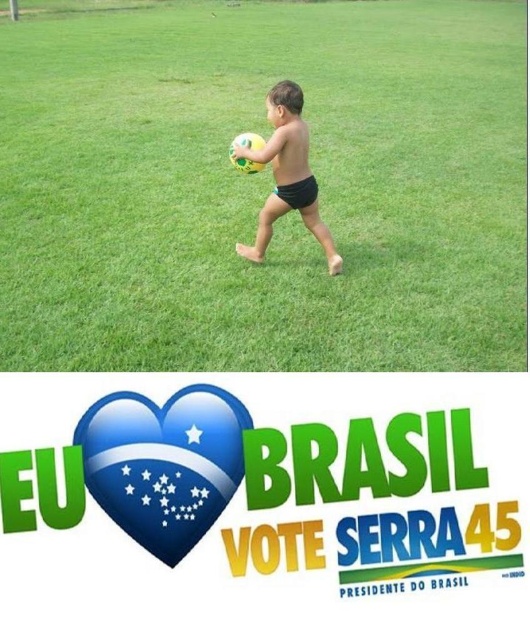
Looking at this image, you are a photographer who wants to capture the matte yellow ball at center and the green grass at center in the same frame. Based on their positions, which object should you focus on first to ensure both are in the shot?

The green grass at center is positioned on the right side of the matte yellow ball at center. To capture both in the same frame, focus on the matte yellow ball at center first since it is on the left, allowing the right side to include the green grass at center.